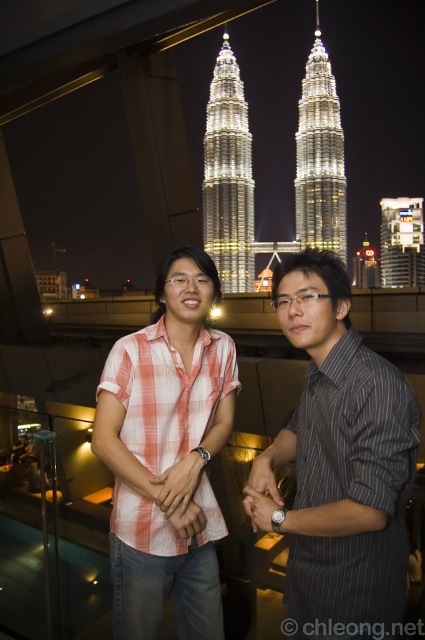
Question: Can you confirm if plaid shirt at center is positioned to the right of white illuminated building at center?

Choices:
 (A) yes
 (B) no

Answer: (B)

Question: Can you confirm if gray striped shirt at center is positioned to the left of white illuminated building at center?

Choices:
 (A) yes
 (B) no

Answer: (A)

Question: Among these objects, which one is farthest from the camera?

Choices:
 (A) metallic glass building at upper center
 (B) gray striped shirt at center
 (C) white illuminated building at center

Answer: (A)

Question: Observing the image, what is the correct spatial positioning of shiny gold twin towers at center in reference to metallic glass building at upper center?

Choices:
 (A) right
 (B) left

Answer: (B)

Question: Estimate the real-world distances between objects in this image. Which object is closer to the plaid shirt at center?

Choices:
 (A) white illuminated building at center
 (B) shiny gold twin towers at center
 (C) metallic glass building at upper center
 (D) gray striped shirt at center

Answer: (D)

Question: Which object is farther from the camera taking this photo?

Choices:
 (A) gray striped shirt at center
 (B) plaid shirt at center
 (C) white illuminated building at center

Answer: (C)